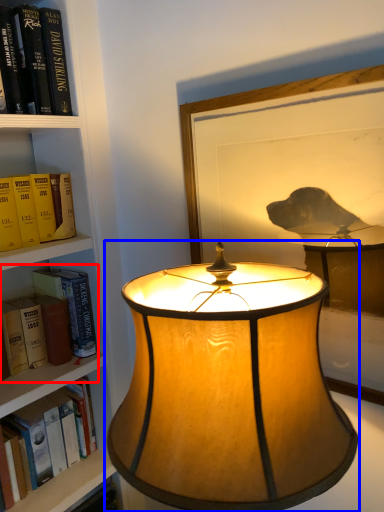
Question: Which object appears closest to the camera in this image, book (highlighted by a red box) or lamp (highlighted by a blue box)?

Choices:
 (A) book
 (B) lamp

Answer: (B)